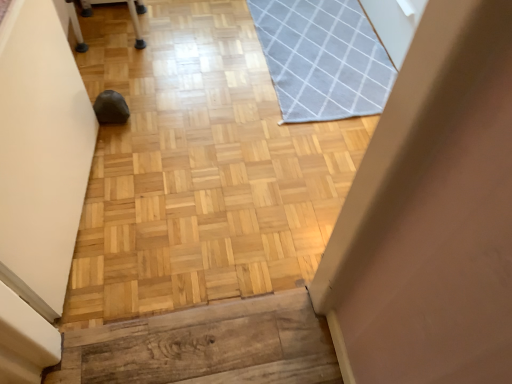
The width and height of the screenshot is (512, 384). I want to click on spots to the right of matte white plastic chair at upper left, so click(168, 47).